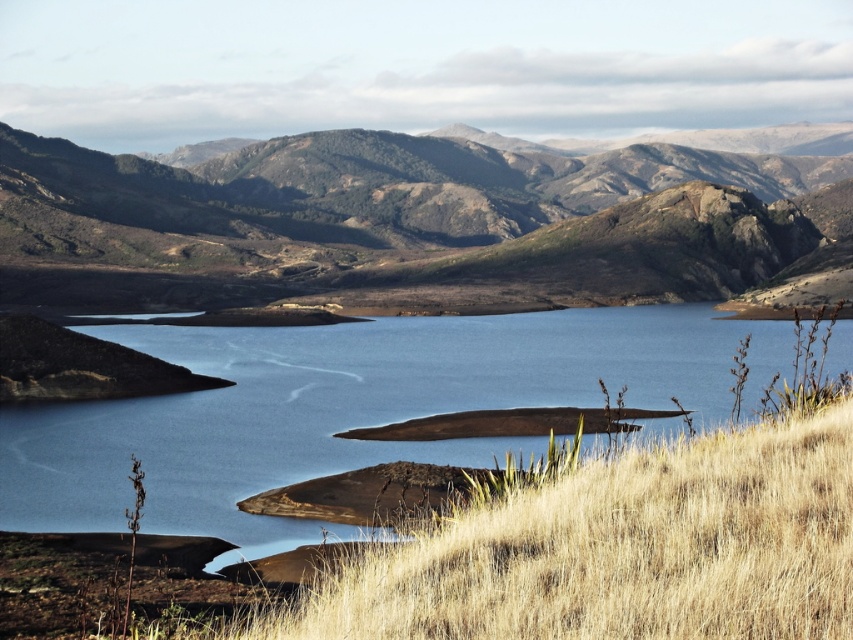
Question: Is rugged brown mountain at center above blue water at center?

Choices:
 (A) yes
 (B) no

Answer: (A)

Question: Can you confirm if rugged brown mountain at center is positioned to the right of blue water at center?

Choices:
 (A) no
 (B) yes

Answer: (B)

Question: Is rugged brown mountain at center to the left of blue water at center from the viewer's perspective?

Choices:
 (A) yes
 (B) no

Answer: (B)

Question: Which point is closer to the camera?

Choices:
 (A) (726, 234)
 (B) (289, 403)

Answer: (B)

Question: Among these objects, which one is farthest from the camera?

Choices:
 (A) rugged brown mountain at center
 (B) blue water at center

Answer: (A)